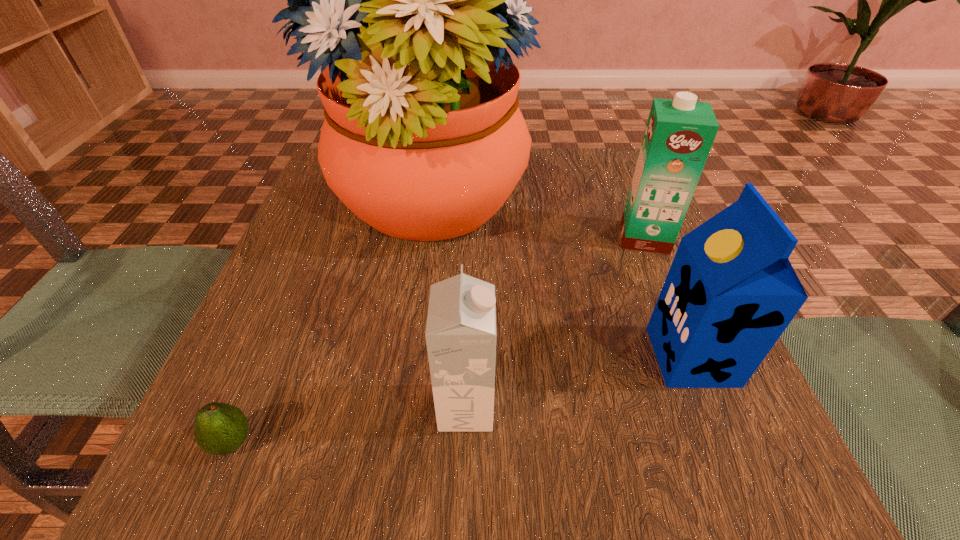
Identify the location of free space in the image that satisfies the following two spatial constraints: 1. on the back side of the avocado; 2. on the left side of the tallest object. The width and height of the screenshot is (960, 540). (332, 205).